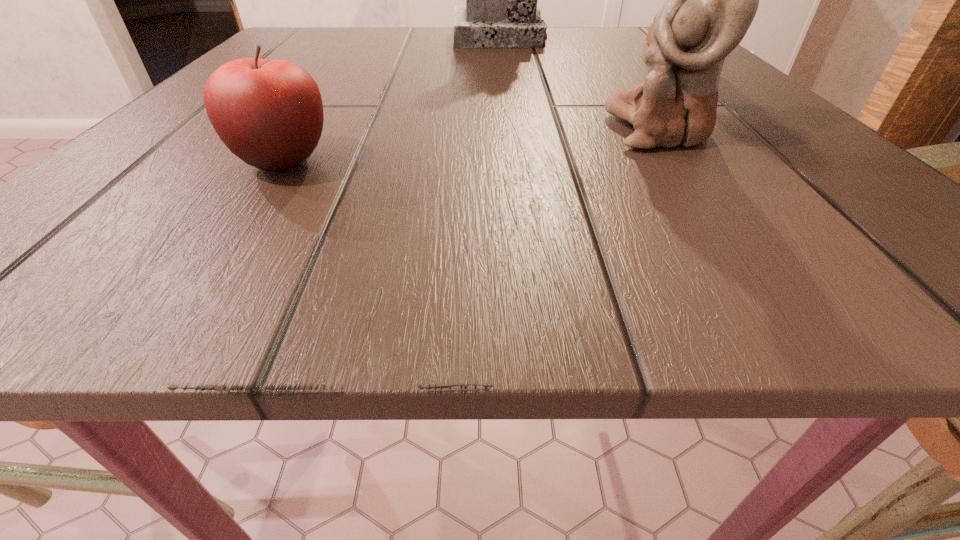
This screenshot has width=960, height=540. I want to click on vacant area between the second object from left to right and the rightmost figurine, so click(583, 44).

Find the location of `vacant space that is in between the leftmost object and the third object from right to left`. vacant space that is in between the leftmost object and the third object from right to left is located at coordinates click(392, 100).

Find the location of `free space between the second object from right to left and the apple`. free space between the second object from right to left and the apple is located at coordinates (472, 146).

Image resolution: width=960 pixels, height=540 pixels. What are the coordinates of `free space between the third object from right to left and the rightmost object` in the screenshot? It's located at (583, 44).

The width and height of the screenshot is (960, 540). I want to click on unoccupied position between the second object from right to left and the second object from left to right, so click(581, 84).

Locate an element on the screen. This screenshot has height=540, width=960. free spot between the leftmost figurine and the rightmost object is located at coordinates (583, 44).

Find the location of a particular element. empty location between the nearest figurine and the second object from left to right is located at coordinates (581, 84).

Where is `free space between the rightmost object and the third object from right to left`? The image size is (960, 540). free space between the rightmost object and the third object from right to left is located at coordinates (583, 44).

The width and height of the screenshot is (960, 540). Identify the location of object that ranks as the third closest to the second object from right to left. (269, 113).

Locate an element on the screen. object that stands as the third closest to the shortest object is located at coordinates (649, 35).